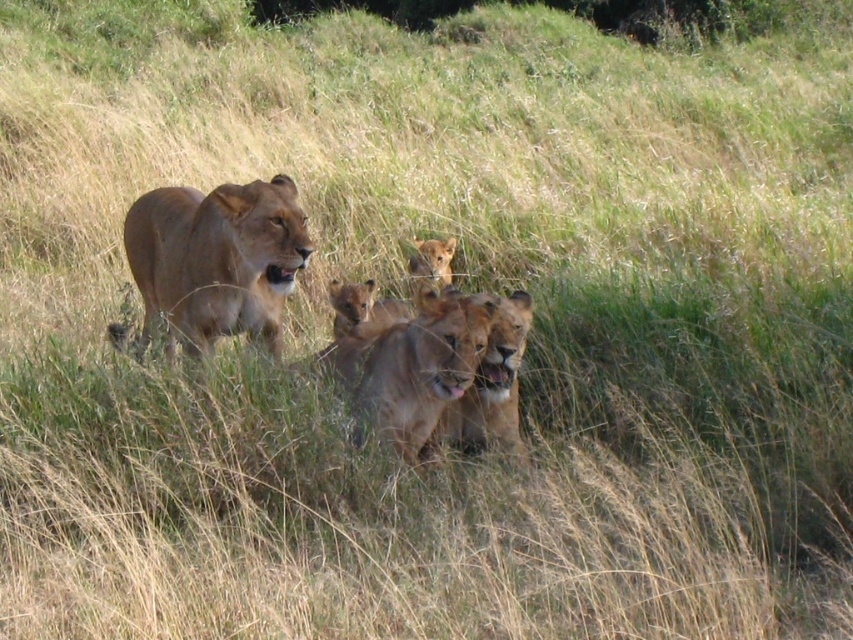
Between golden fur lioness at center and golden fur cub at center, which one appears on the right side from the viewer's perspective?

golden fur cub at center

Is point (259, 336) closer to viewer compared to point (415, 243)?

Yes.

Image resolution: width=853 pixels, height=640 pixels. I want to click on golden fur lioness at center, so click(218, 259).